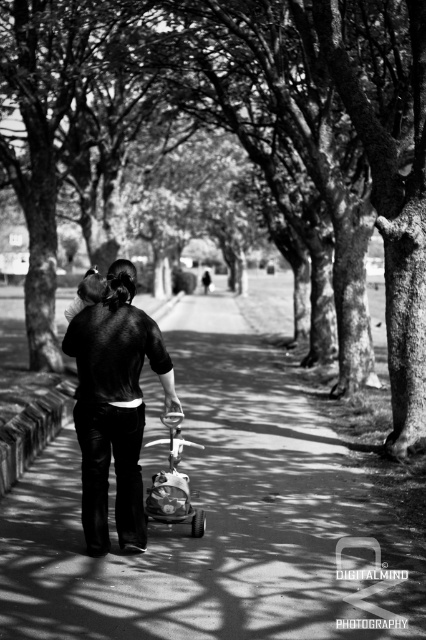
Question: Among these objects, which one is nearest to the camera?

Choices:
 (A) dark matte jacket at center
 (B) smooth concrete pavement at center
 (C) matte plastic baby carriage at center

Answer: (B)

Question: Based on their relative distances, which object is nearer to the smooth bark tree at center?

Choices:
 (A) matte plastic baby carriage at center
 (B) smooth concrete pavement at center

Answer: (B)

Question: Is smooth concrete pavement at center to the left of matte plastic baby carriage at center from the viewer's perspective?

Choices:
 (A) yes
 (B) no

Answer: (B)

Question: Does smooth concrete pavement at center have a larger size compared to dark matte jacket at center?

Choices:
 (A) yes
 (B) no

Answer: (A)

Question: Is smooth bark tree at center above dark matte jacket at center?

Choices:
 (A) yes
 (B) no

Answer: (A)

Question: Estimate the real-world distances between objects in this image. Which object is farther from the dark matte jacket at center?

Choices:
 (A) smooth concrete pavement at center
 (B) smooth bark tree at center
 (C) matte plastic baby carriage at center

Answer: (B)